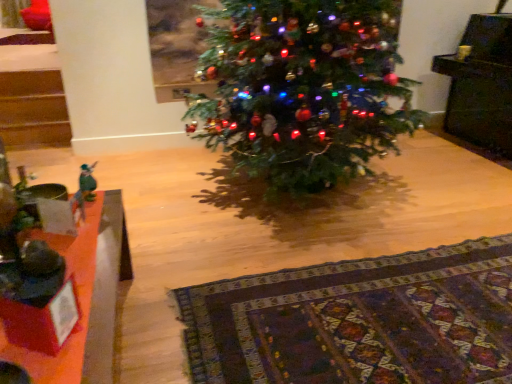
Locate an element on the screen. The width and height of the screenshot is (512, 384). free space behind wooden table at lower left is located at coordinates (183, 252).